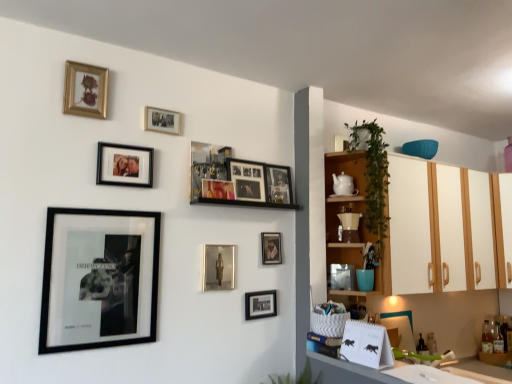
Image resolution: width=512 pixels, height=384 pixels. Describe the element at coordinates (124, 165) in the screenshot. I see `matte black photo frame at upper center, the 9th picture frame viewed from the right` at that location.

How much space does gold-framed photo at upper center, the 8th picture frame in the right-to-left sequence, occupy vertically?

The height of gold-framed photo at upper center, the 8th picture frame in the right-to-left sequence, is 4.76 inches.

Locate an element on the screen. This screenshot has width=512, height=384. green leafy plant at upper right, placed as the first plant when sorted from right to left is located at coordinates (374, 178).

This screenshot has height=384, width=512. What do you see at coordinates (278, 184) in the screenshot?
I see `metallic silver picture frame at upper center, which appears as the eleventh picture frame when viewed from the left` at bounding box center [278, 184].

Where is `black matte picture frame at lower left, placed as the 2th picture frame when sorted from left to right`? The width and height of the screenshot is (512, 384). black matte picture frame at lower left, placed as the 2th picture frame when sorted from left to right is located at coordinates (99, 279).

The width and height of the screenshot is (512, 384). In order to click on matte black photo frame at upper center, the 9th picture frame viewed from the right in this screenshot , I will do `click(124, 165)`.

From the image's perspective, between matte black photo frame at upper center, the 3th picture frame viewed from the left, and matte black picture frame at lower center, which appears as the 9th picture frame when viewed from the left, which one is located above?

From the image's view, matte black photo frame at upper center, the 3th picture frame viewed from the left, is above.

Is matte black photo frame at upper center, the 3th picture frame viewed from the left, surrounding matte black picture frame at lower center, which appears as the 9th picture frame when viewed from the left?

No, matte black photo frame at upper center, the 3th picture frame viewed from the left, does not contain matte black picture frame at lower center, which appears as the 9th picture frame when viewed from the left.

Which is more to the right, matte black photo frame at upper center, the 9th picture frame viewed from the right, or matte black picture frame at lower center, which appears as the 9th picture frame when viewed from the left?

matte black picture frame at lower center, which appears as the 9th picture frame when viewed from the left.

How much distance is there between matte black photo frame at upper center, the 9th picture frame viewed from the right, and matte black picture frame at lower center, the 3th picture frame positioned from the right?

31.83 inches.

Is metallic silver photo frame at upper center, placed as the 6th picture frame when sorted from left to right, far from metallic silver picture frame at upper center, the 1th picture frame positioned from the right?

metallic silver photo frame at upper center, placed as the 6th picture frame when sorted from left to right, is actually quite close to metallic silver picture frame at upper center, the 1th picture frame positioned from the right.

Which is behind, point (216, 184) or point (286, 168)?

Point (286, 168)

Which object is wider, metallic silver photo frame at upper center, the sixth picture frame when ordered from right to left, or metallic silver picture frame at upper center, which appears as the eleventh picture frame when viewed from the left?

With larger width is metallic silver picture frame at upper center, which appears as the eleventh picture frame when viewed from the left.

This screenshot has height=384, width=512. Identify the location of the 6th picture frame behind the metallic silver photo frame at upper center, the sixth picture frame when ordered from right to left, counting from the anchor's position. (278, 184).

Is metallic silver photo frame at center, the seventh picture frame positioned from the left, bigger than wooden shelves at right?

No, metallic silver photo frame at center, the seventh picture frame positioned from the left, is not bigger than wooden shelves at right.

Which object is closer to the camera, metallic silver photo frame at center, the seventh picture frame positioned from the left, or wooden shelves at right?

metallic silver photo frame at center, the seventh picture frame positioned from the left.

Considering the positions of point (212, 260) and point (360, 158), is point (212, 260) closer or farther from the camera than point (360, 158)?

Point (212, 260).

The height and width of the screenshot is (384, 512). In order to click on shelf that appears on the right of metallic silver photo frame at center, the seventh picture frame positioned from the left in this screenshot , I will do `click(345, 204)`.

Which object is wider, matte black picture frame at center, the second picture frame positioned from the right, or metallic silver photo frame at upper center, placed as the 6th picture frame when sorted from left to right?

matte black picture frame at center, the second picture frame positioned from the right, is wider.

Could you tell me if matte black picture frame at center, the second picture frame positioned from the right, is facing metallic silver photo frame at upper center, the sixth picture frame when ordered from right to left?

No, matte black picture frame at center, the second picture frame positioned from the right, is not turned towards metallic silver photo frame at upper center, the sixth picture frame when ordered from right to left.

Would you say matte black picture frame at center, the second picture frame positioned from the right, is a long distance from metallic silver photo frame at upper center, placed as the 6th picture frame when sorted from left to right?

That's not correct — matte black picture frame at center, the second picture frame positioned from the right, is a little close to metallic silver photo frame at upper center, placed as the 6th picture frame when sorted from left to right.

Which is less distant, (x=281, y=260) or (x=224, y=198)?

Point (x=281, y=260) is positioned farther from the camera compared to point (x=224, y=198).

Looking at this image, is metallic silver photo frame at upper center, which is the 8th picture frame in left-to-right order, completely or partially outside of matte black photo frame at upper center, the 3th picture frame viewed from the left?

That's correct, metallic silver photo frame at upper center, which is the 8th picture frame in left-to-right order, is outside of matte black photo frame at upper center, the 3th picture frame viewed from the left.

Based on their positions, is metallic silver photo frame at upper center, which appears as the 4th picture frame when viewed from the right, located to the left or right of matte black photo frame at upper center, the 9th picture frame viewed from the right?

From the image, it's evident that metallic silver photo frame at upper center, which appears as the 4th picture frame when viewed from the right, is to the right of matte black photo frame at upper center, the 9th picture frame viewed from the right.

Is black matte picture frame at lower left, placed as the 2th picture frame when sorted from left to right, positioned with its back to wooden shelves at right?

No, black matte picture frame at lower left, placed as the 2th picture frame when sorted from left to right,'s orientation is not away from wooden shelves at right.

Is black matte picture frame at lower left, arranged as the tenth picture frame when viewed from the right, at the left side of wooden shelves at right?

Correct, you'll find black matte picture frame at lower left, arranged as the tenth picture frame when viewed from the right, to the left of wooden shelves at right.

Does black matte picture frame at lower left, arranged as the tenth picture frame when viewed from the right, have a greater width compared to wooden shelves at right?

Incorrect, the width of black matte picture frame at lower left, arranged as the tenth picture frame when viewed from the right, does not surpass that of wooden shelves at right.

From a real-world perspective, which picture frame is the 3rd one above the white wood cabinet at right, arranged as the first cabinetry when viewed from the right? Please provide its 2D coordinates.

[(247, 179)]

Is white wood cabinet at right, the 2th cabinetry viewed from the left, located outside metallic silver photo frame at upper center, which appears as the 4th picture frame when viewed from the right?

Indeed, white wood cabinet at right, the 2th cabinetry viewed from the left, is completely outside metallic silver photo frame at upper center, which appears as the 4th picture frame when viewed from the right.

Considering the sizes of objects white wood cabinet at right, arranged as the first cabinetry when viewed from the right, and metallic silver photo frame at upper center, which is the 8th picture frame in left-to-right order, in the image provided, who is smaller, white wood cabinet at right, arranged as the first cabinetry when viewed from the right, or metallic silver photo frame at upper center, which is the 8th picture frame in left-to-right order,?

Smaller between the two is metallic silver photo frame at upper center, which is the 8th picture frame in left-to-right order.

Between white wood cabinet at right, arranged as the first cabinetry when viewed from the right, and metallic silver photo frame at upper center, which is the 8th picture frame in left-to-right order, which one has smaller width?

metallic silver photo frame at upper center, which is the 8th picture frame in left-to-right order, is thinner.

Identify the location of the 6th picture frame in front of the matte black picture frame at lower center, which appears as the 9th picture frame when viewed from the left, counting from the anchor's position. This screenshot has height=384, width=512. (124, 165).

From the image's perspective, starting from the metallic silver photo frame at upper center, the sixth picture frame when ordered from right to left, which picture frame is the 1st one above? Please provide its 2D coordinates.

[(278, 184)]

Looking at the image, which one is located further to white wood cabinet at right, the 2th cabinetry viewed from the left, matte black photo frame at upper center, the 3th picture frame viewed from the left, or metallic silver photo frame at upper center, placed as the 6th picture frame when sorted from left to right?

matte black photo frame at upper center, the 3th picture frame viewed from the left, is positioned further to the anchor white wood cabinet at right, the 2th cabinetry viewed from the left.

When comparing their distances from matte black photo frame at upper center, the 3th picture frame viewed from the left, does metallic silver picture frame at upper center, which appears as the eleventh picture frame when viewed from the left, or white glossy cabinet at right, arranged as the 2th cabinetry when viewed from the right, seem closer?

metallic silver picture frame at upper center, which appears as the eleventh picture frame when viewed from the left, is closer to matte black photo frame at upper center, the 3th picture frame viewed from the left.

Considering their positions, is metallic silver picture frame at upper center, the 1th picture frame positioned from the right, positioned closer to white glossy cabinet at right, arranged as the 2th cabinetry when viewed from the right, than metallic/reflective picture frame at upper center, the 7th picture frame positioned from the right?

metallic silver picture frame at upper center, the 1th picture frame positioned from the right, lies closer to white glossy cabinet at right, arranged as the 2th cabinetry when viewed from the right, than the other object.

Considering their positions, is metallic silver picture frame at upper center, which appears as the eleventh picture frame when viewed from the left, positioned closer to metallic/reflective picture frame at upper center, placed as the 5th picture frame when sorted from left to right, than gold-framed picture at upper left, arranged as the 11th picture frame when viewed from the right?

Among the two, metallic silver picture frame at upper center, which appears as the eleventh picture frame when viewed from the left, is located nearer to metallic/reflective picture frame at upper center, placed as the 5th picture frame when sorted from left to right.

From the image, which object appears to be farther from matte black picture frame at center, which is the 10th picture frame in left-to-right order, green leafy plant at upper right, placed as the first plant when sorted from right to left, or metallic silver photo frame at center, the seventh picture frame positioned from the left?

green leafy plant at upper right, placed as the first plant when sorted from right to left, is further to matte black picture frame at center, which is the 10th picture frame in left-to-right order.

Considering their positions, is matte black photo frame at upper center, the 3th picture frame viewed from the left, positioned further to metallic silver photo frame at center, the 5th picture frame positioned from the right, than gold-framed picture at upper left, arranged as the 11th picture frame when viewed from the right?

gold-framed picture at upper left, arranged as the 11th picture frame when viewed from the right, lies further to metallic silver photo frame at center, the 5th picture frame positioned from the right, than the other object.

From the image, which object appears to be farther from matte black photo frame at upper center, the 9th picture frame viewed from the right, matte black picture frame at lower center, which appears as the 9th picture frame when viewed from the left, or green leafy plant at lower center, marked as the first plant in a left-to-right arrangement?

green leafy plant at lower center, marked as the first plant in a left-to-right arrangement, is positioned further to the anchor matte black photo frame at upper center, the 9th picture frame viewed from the right.

Which object lies nearer to the anchor point metallic silver photo frame at upper center, which is the 8th picture frame in left-to-right order, gold-framed picture at upper left, placed as the 1th picture frame when sorted from left to right, or white glossy cabinet at right, which is counted as the 1th cabinetry, starting from the left?

The object closer to metallic silver photo frame at upper center, which is the 8th picture frame in left-to-right order, is gold-framed picture at upper left, placed as the 1th picture frame when sorted from left to right.

The width and height of the screenshot is (512, 384). Find the location of `shelf between metallic silver photo frame at center, the 5th picture frame positioned from the right, and green leafy plant at upper right, which ranks as the second plant in left-to-right order`. shelf between metallic silver photo frame at center, the 5th picture frame positioned from the right, and green leafy plant at upper right, which ranks as the second plant in left-to-right order is located at coordinates [345, 204].

In order to click on shelf located between black matte picture frame at lower left, placed as the 2th picture frame when sorted from left to right, and white wood cabinet at right, arranged as the first cabinetry when viewed from the right, in the left-right direction in this screenshot , I will do `click(345, 204)`.

This screenshot has height=384, width=512. In order to click on cabinetry between wooden shelves at right and white wood cabinet at right, the 2th cabinetry viewed from the left in this screenshot , I will do `click(447, 227)`.

Find the location of `shelf between metallic silver picture frame at upper center, the 1th picture frame positioned from the right, and matte black picture frame at lower center, the 3th picture frame positioned from the right, in the up-down direction`. shelf between metallic silver picture frame at upper center, the 1th picture frame positioned from the right, and matte black picture frame at lower center, the 3th picture frame positioned from the right, in the up-down direction is located at coordinates (345, 204).